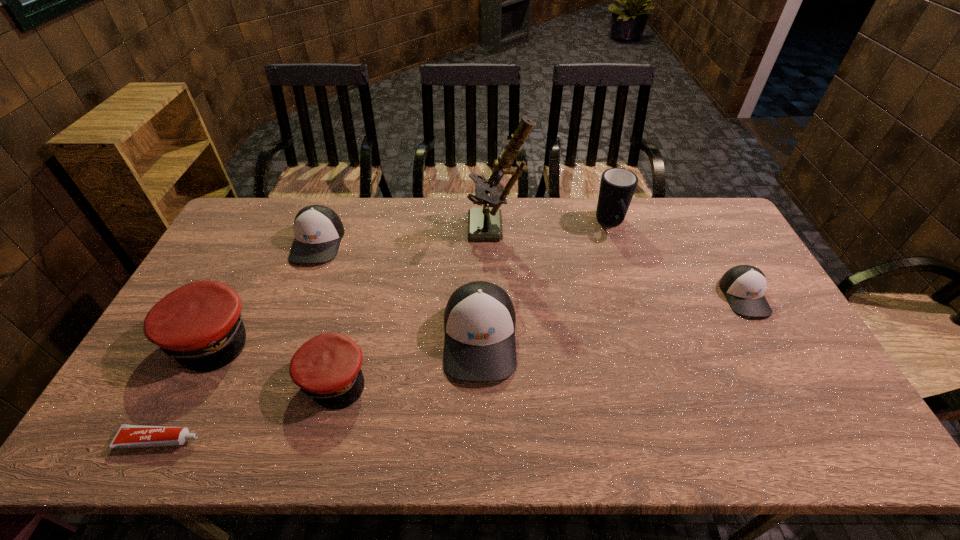
The image size is (960, 540). I want to click on empty space that is in between the farthest cap and the tallest object, so click(408, 236).

Find the location of a particular element. The image size is (960, 540). free space between the shortest object and the smaller red cap is located at coordinates (246, 409).

Locate an element on the screen. unoccupied area between the third cap from left to right and the nearest object is located at coordinates (x=246, y=409).

I want to click on object that is the fifth closest to the brown microscope, so pyautogui.click(x=744, y=286).

Locate an element on the screen. object that is the seventh closest to the smallest gray cap is located at coordinates (127, 436).

The height and width of the screenshot is (540, 960). I want to click on cap object that ranks as the third closest to the rightmost cap, so click(318, 230).

The width and height of the screenshot is (960, 540). Find the location of `the third closest cap to the second object from right to left`. the third closest cap to the second object from right to left is located at coordinates (327, 368).

Select which gray cap appears as the second closest to the toothpaste. Please provide its 2D coordinates. Your answer should be formatted as a tuple, i.e. [(x, y)], where the tuple contains the x and y coordinates of a point satisfying the conditions above.

[(479, 319)]

This screenshot has height=540, width=960. In order to click on gray cap that stands as the second closest to the shortest object in this screenshot , I will do `click(479, 319)`.

Image resolution: width=960 pixels, height=540 pixels. Identify the location of vacant space that satisfies the following two spatial constraints: 1. on the side of the seventh shortest object with the handle; 2. at the front of the smaller red cap where the visor is located. (661, 378).